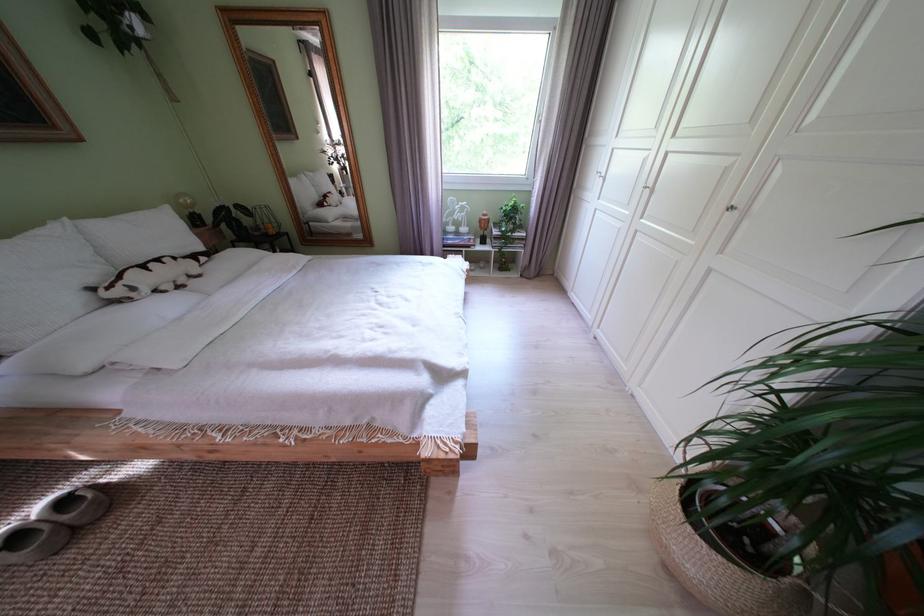
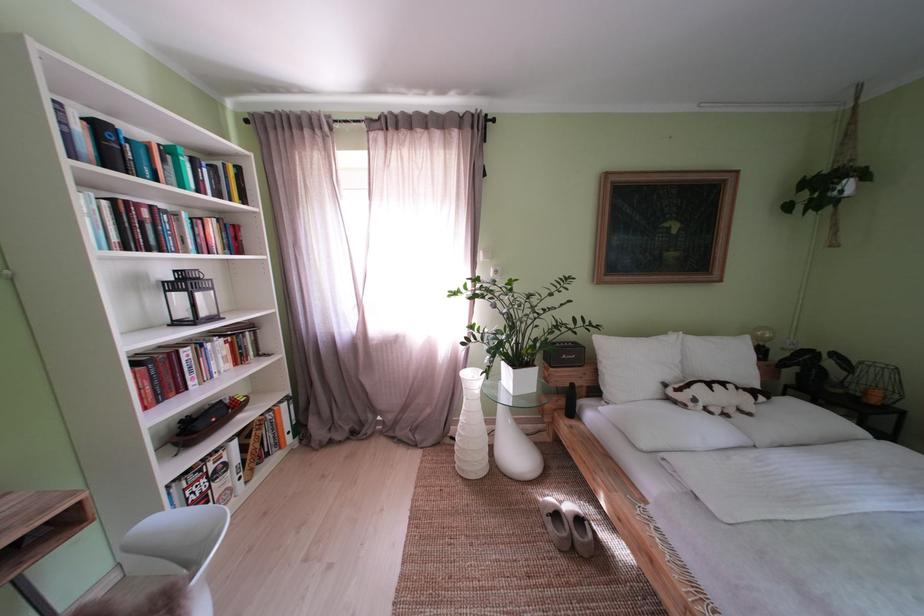
In the second image, find the point that corresponds to point 28,543 in the first image.

(567, 521)